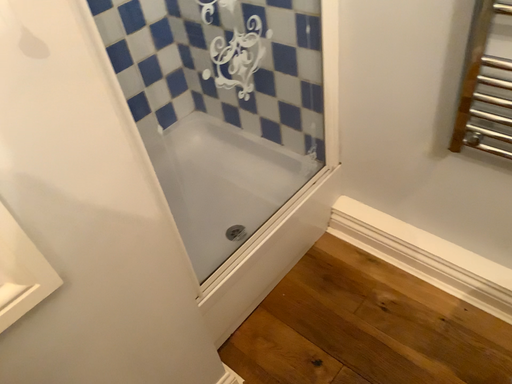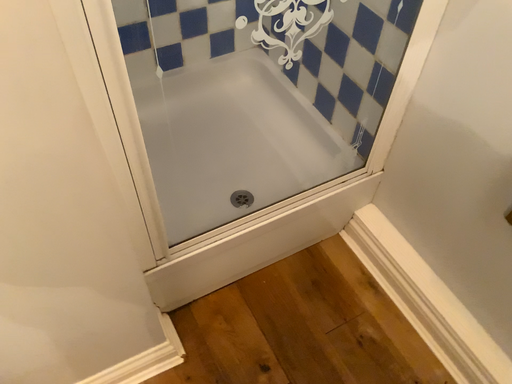
Question: How did the camera likely rotate when shooting the video?

Choices:
 (A) rotated downward
 (B) rotated upward

Answer: (A)